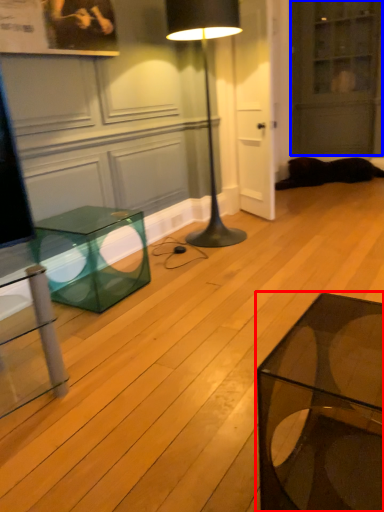
Question: Which of the following is the farthest to the observer, coffee table (highlighted by a red box) or glass door (highlighted by a blue box)?

Choices:
 (A) coffee table
 (B) glass door

Answer: (B)